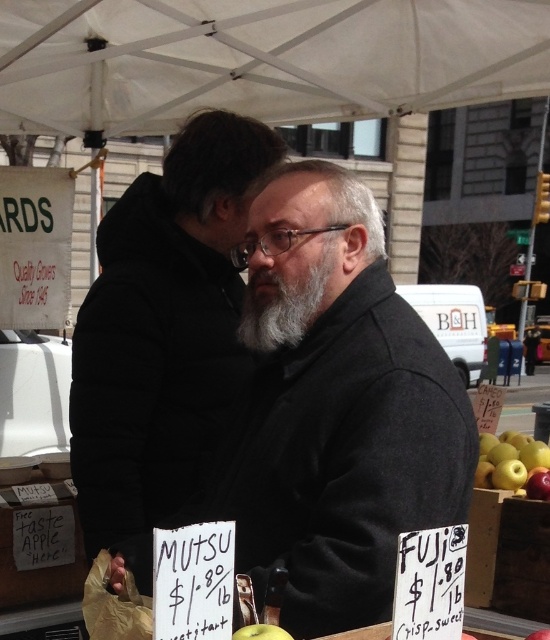
Between white fabric canopy at upper center and gray matte beard at center, which one appears on the right side from the viewer's perspective?

Positioned to the right is gray matte beard at center.

Can you confirm if white fabric canopy at upper center is wider than gray matte beard at center?

Indeed, white fabric canopy at upper center has a greater width compared to gray matte beard at center.

At what (x,y) coordinates should I click in order to perform the action: click on white fabric canopy at upper center. Please return your answer as a coordinate pair (x, y). Image resolution: width=550 pixels, height=640 pixels. Looking at the image, I should click on (260, 60).

The height and width of the screenshot is (640, 550). Find the location of `white fabric canopy at upper center`. white fabric canopy at upper center is located at coordinates (260, 60).

Which of these two, dark gray wool coat at center or green matte apple at lower center, stands shorter?

With less height is green matte apple at lower center.

Which is below, dark gray wool coat at center or green matte apple at lower center?

Positioned lower is green matte apple at lower center.

Is point (184, 154) farther from camera compared to point (253, 627)?

Yes, it is.

This screenshot has height=640, width=550. In order to click on dark gray wool coat at center in this screenshot , I will do `click(298, 390)`.

Is white fabric canopy at upper center to the right of green matte apples at lower right from the viewer's perspective?

Incorrect, white fabric canopy at upper center is not on the right side of green matte apples at lower right.

Does white fabric canopy at upper center have a lesser height compared to green matte apples at lower right?

No.

Measure the distance between white fabric canopy at upper center and camera.

They are 7.44 feet apart.

You are a GUI agent. You are given a task and a screenshot of the screen. Output one action in this format:
    pyautogui.click(x=<x>, y=<y>)
    Task: Click on the white fabric canopy at upper center
    
    Given the screenshot: What is the action you would take?
    pyautogui.click(x=260, y=60)